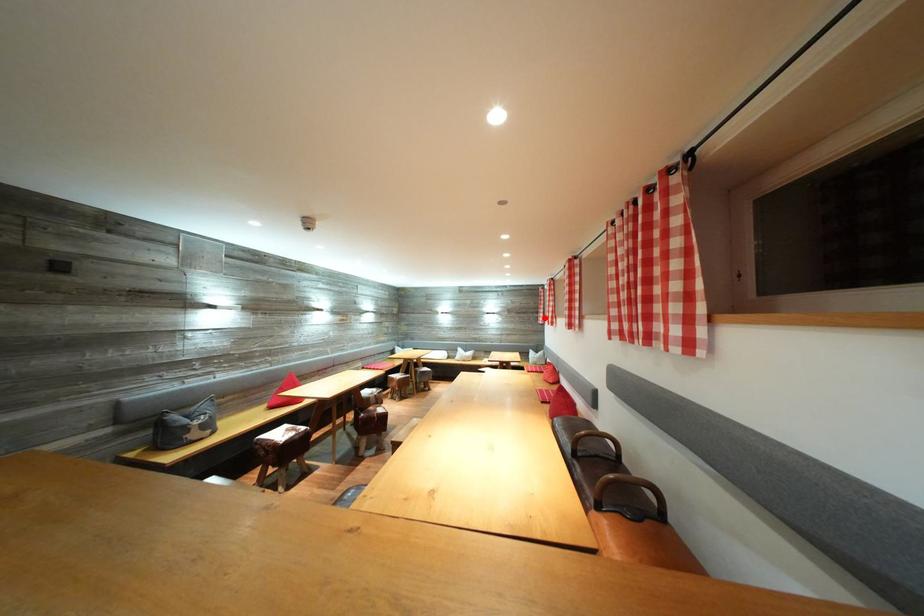
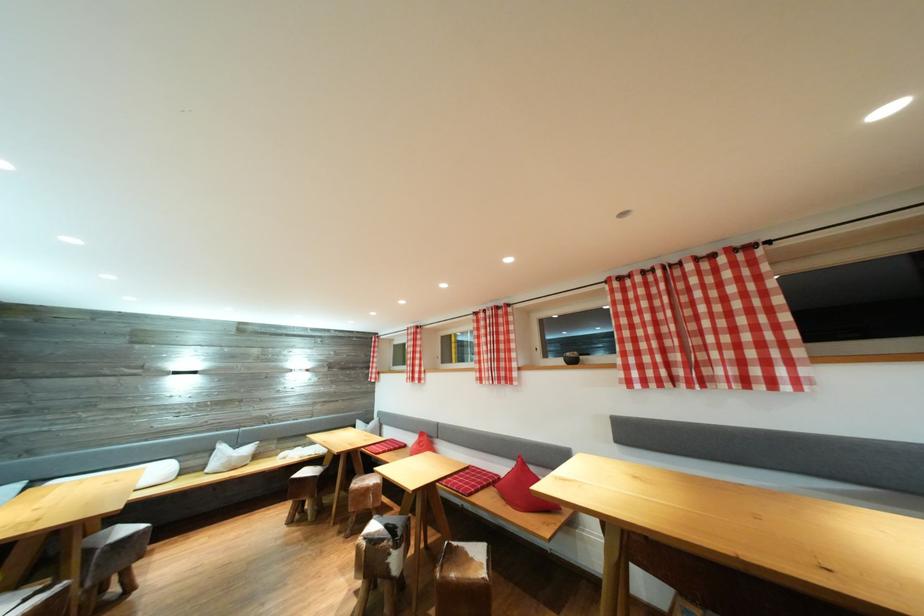
Find the pixel in the second image that matches the highlighted location in the first image.

(375, 373)